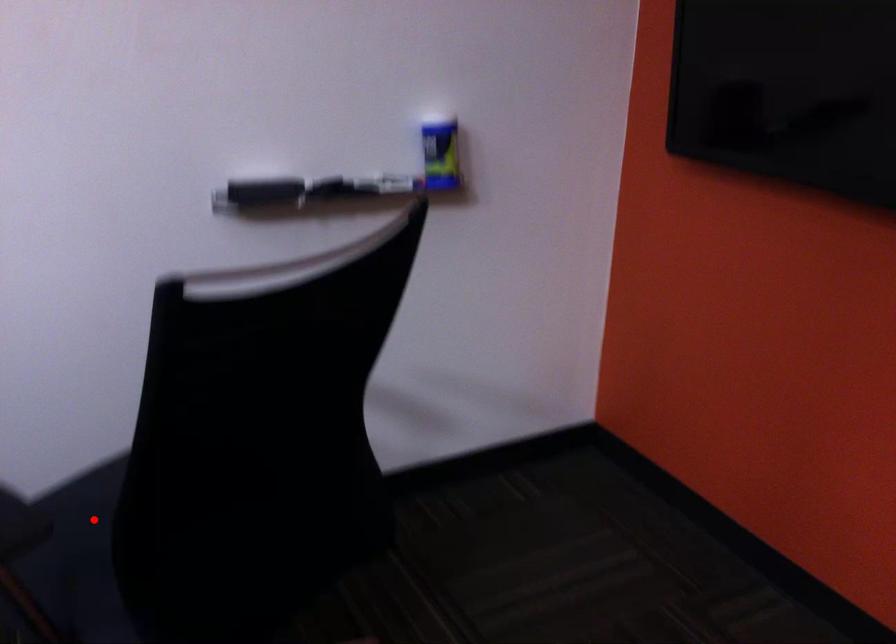
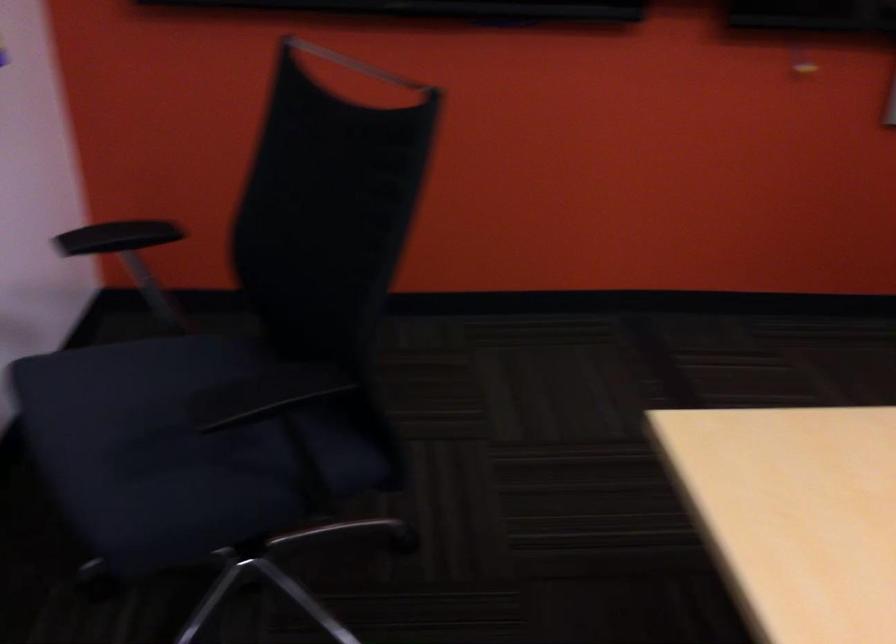
Locate, in the second image, the point that corresponds to the highlighted location in the first image.

(167, 442)